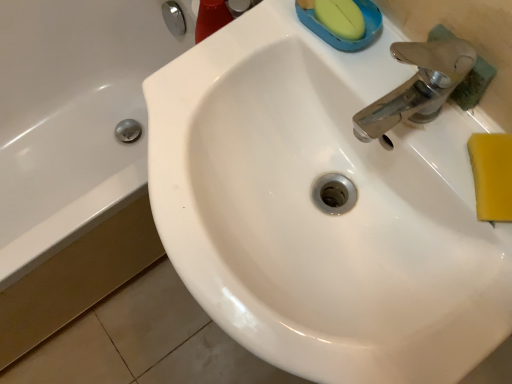
Question: Considering the positions of white glossy bathtub at left and white glossy sink at center in the image, is white glossy bathtub at left taller or shorter than white glossy sink at center?

Choices:
 (A) short
 (B) tall

Answer: (A)

Question: Is white glossy bathtub at left spatially inside white glossy sink at center, or outside of it?

Choices:
 (A) inside
 (B) outside

Answer: (B)

Question: Based on their relative distances, which object is farther from the white glossy sink at center?

Choices:
 (A) yellow sponge at right
 (B) white glossy bathtub at left

Answer: (B)

Question: Based on their relative distances, which object is farther from the white glossy bathtub at left?

Choices:
 (A) yellow sponge at right
 (B) white glossy sink at center

Answer: (A)